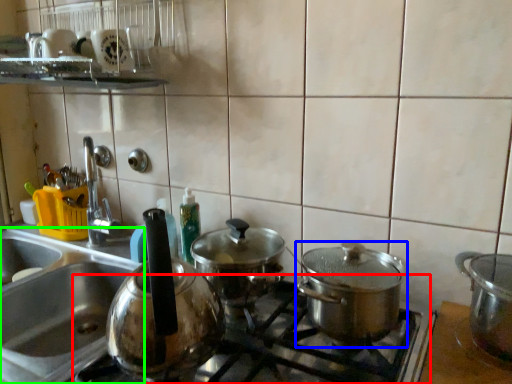
Question: Based on their relative distances, which object is nearer to gas stove (highlighted by a red box)? Choose from kitchen appliance (highlighted by a blue box) and sink (highlighted by a green box).

Choices:
 (A) kitchen appliance
 (B) sink

Answer: (A)